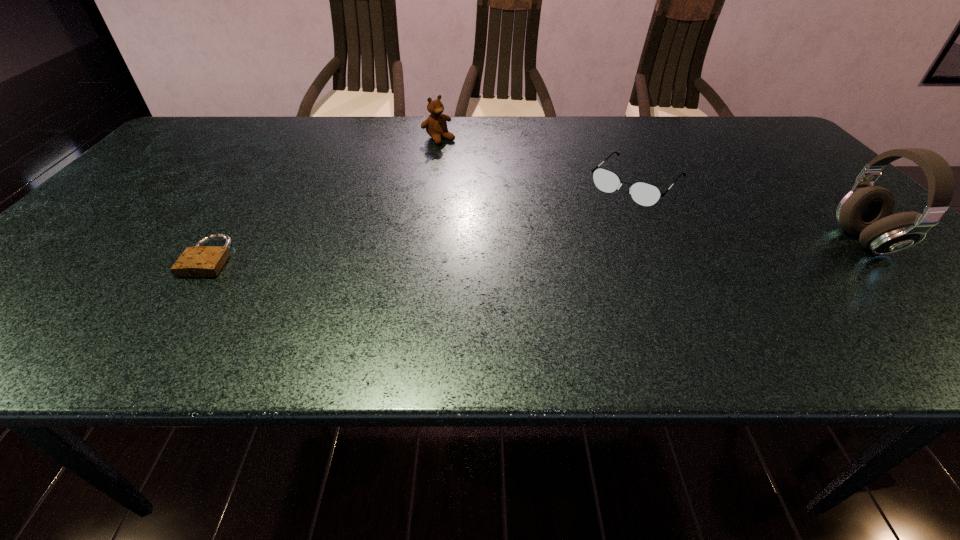
Identify the location of vacant space at the right edge of the desktop. (804, 196).

Locate an element on the screen. Image resolution: width=960 pixels, height=540 pixels. vacant space at the near right corner is located at coordinates (875, 292).

Identify the location of free area in between the second shortest object and the teddy bear. (538, 161).

This screenshot has width=960, height=540. I want to click on empty space between the leftmost object and the second shortest object, so click(x=423, y=220).

Identify the location of vacant area that lies between the second object from right to left and the padlock. (423, 220).

This screenshot has height=540, width=960. I want to click on free space that is in between the rightmost object and the leftmost object, so click(x=537, y=249).

I want to click on free space that is in between the leftmost object and the rightmost object, so click(x=537, y=249).

Find the location of a particular element. The width and height of the screenshot is (960, 540). free spot between the tallest object and the third object from left to right is located at coordinates (751, 212).

Find the location of `free spot between the tallest object and the leftmost object`. free spot between the tallest object and the leftmost object is located at coordinates (537, 249).

You are a GUI agent. You are given a task and a screenshot of the screen. Output one action in this format:
    pyautogui.click(x=<x>, y=<y>)
    Task: Click on the free space between the rightmost object and the shortest object
    
    Given the screenshot: What is the action you would take?
    pyautogui.click(x=537, y=249)